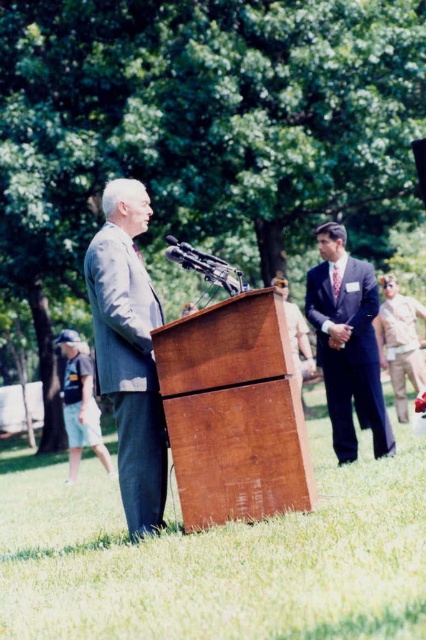
Question: Can you confirm if gray suit at center is positioned to the left of dark gray suit at right?

Choices:
 (A) yes
 (B) no

Answer: (A)

Question: In this image, where is brown wood podium at center located relative to gray suit at center?

Choices:
 (A) below
 (B) above

Answer: (A)

Question: Which point is closer to the camera?

Choices:
 (A) brown wood podium at center
 (B) dark gray suit at right
 (C) gray suit at center

Answer: (A)

Question: Which point appears closest to the camera in this image?

Choices:
 (A) (135, 362)
 (B) (359, 365)
 (C) (294, 410)

Answer: (C)

Question: Is brown wood podium at center below gray suit at center?

Choices:
 (A) no
 (B) yes

Answer: (B)

Question: Which object appears closest to the camera in this image?

Choices:
 (A) brown wood podium at center
 (B) dark gray suit at right
 (C) gray suit at center

Answer: (A)